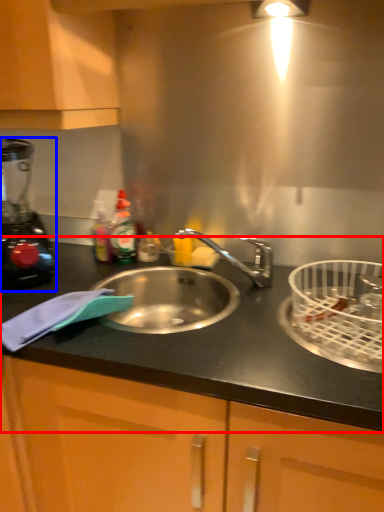
Question: Which object is further to the camera taking this photo, countertop (highlighted by a red box) or blender (highlighted by a blue box)?

Choices:
 (A) countertop
 (B) blender

Answer: (B)